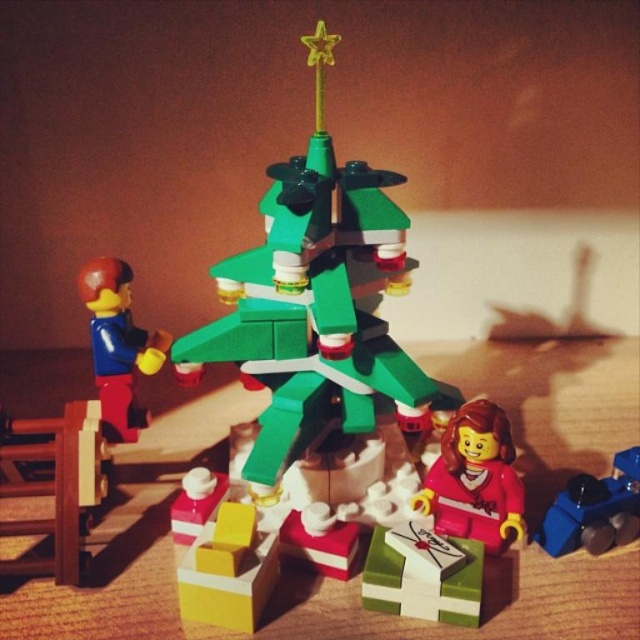
Which is above, matte blue plastic figure at left or blue plastic train at lower right?

matte blue plastic figure at left

Is point (80, 273) farther from camera compared to point (632, 522)?

No.

Is point (115, 404) positioned in front of point (560, 540)?

No, (115, 404) is further to viewer.

Locate an element on the screen. The image size is (640, 640). matte blue plastic figure at left is located at coordinates (116, 346).

Does smooth red minifigure at center appear over blue plastic train at lower right?

Yes, smooth red minifigure at center is above blue plastic train at lower right.

Who is shorter, smooth red minifigure at center or blue plastic train at lower right?

blue plastic train at lower right

What do you see at coordinates (474, 477) in the screenshot?
I see `smooth red minifigure at center` at bounding box center [474, 477].

Locate an element on the screen. The height and width of the screenshot is (640, 640). smooth red minifigure at center is located at coordinates (474, 477).

Find the location of a particular element. The width and height of the screenshot is (640, 640). green matte christmas tree at center is located at coordinates (314, 305).

Locate an element on the screen. green matte christmas tree at center is located at coordinates (314, 305).

Locate an element on the screen. This screenshot has height=640, width=640. green matte christmas tree at center is located at coordinates (314, 305).